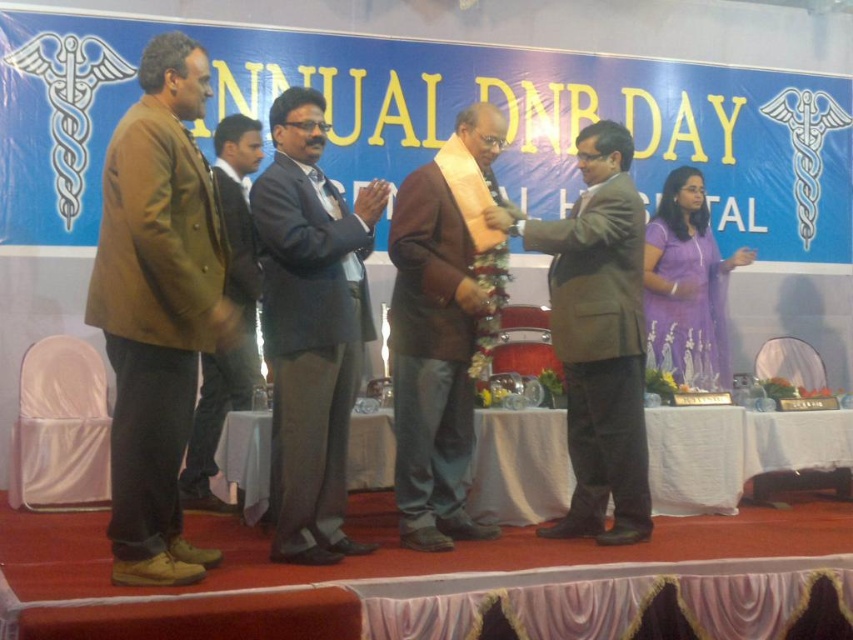
Question: Can you confirm if brown matte jacket at center is positioned to the left of brown woolen jacket at left?

Choices:
 (A) yes
 (B) no

Answer: (B)

Question: Estimate the real-world distances between objects in this image. Which object is farther from the dark gray suit at center?

Choices:
 (A) brown matte jacket at center
 (B) matte brown suit at center

Answer: (B)

Question: Is matte brown suit at center to the right of brown woolen jacket at left from the viewer's perspective?

Choices:
 (A) yes
 (B) no

Answer: (A)

Question: Considering the real-world distances, which object is closest to the brown matte jacket at center?

Choices:
 (A) brown woolen jacket at left
 (B) dark gray suit at center
 (C) brown leather jacket at left
 (D) matte brown suit at center

Answer: (B)

Question: Which is nearer to the brown matte jacket at center?

Choices:
 (A) dark gray suit at center
 (B) brown woolen jacket at left
 (C) matte brown suit at center

Answer: (A)

Question: Does brown leather jacket at left lie in front of matte brown suit at center?

Choices:
 (A) no
 (B) yes

Answer: (B)